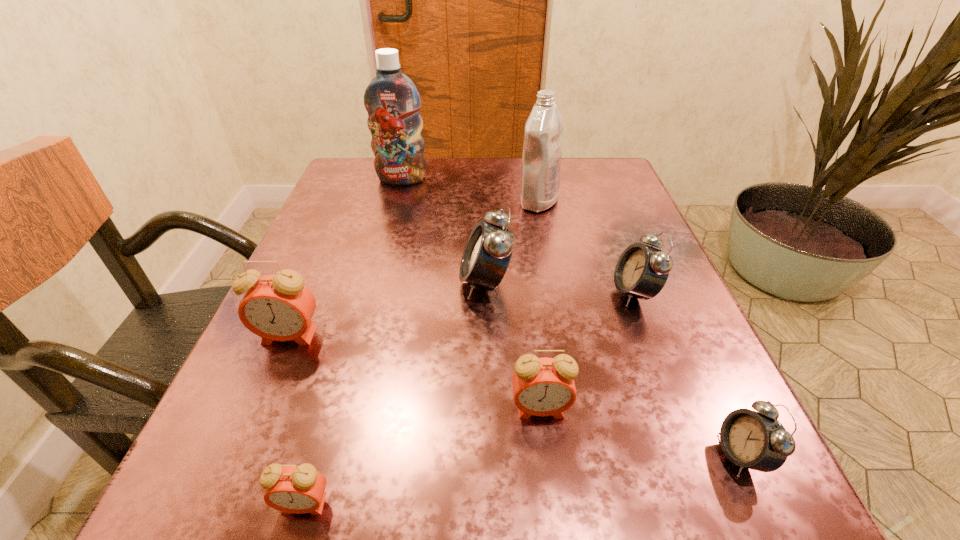
Where is `free space between the detergent and the nearest object`? The width and height of the screenshot is (960, 540). free space between the detergent and the nearest object is located at coordinates (421, 353).

At what (x,y) coordinates should I click in order to perform the action: click on free space between the second pink alarm clock from left to right and the farthest object. Please return your answer as a coordinate pair (x, y). This screenshot has height=540, width=960. Looking at the image, I should click on (353, 342).

You are a GUI agent. You are given a task and a screenshot of the screen. Output one action in this format:
    pyautogui.click(x=<x>, y=<y>)
    Task: Click on the vacant space in between the leftmost white alarm clock and the farthest pink alarm clock
    
    Given the screenshot: What is the action you would take?
    pyautogui.click(x=387, y=309)

At what (x,y) coordinates should I click in order to perform the action: click on empty space that is in between the third nearest object and the second nearest object. Please return your answer as a coordinate pair (x, y). This screenshot has width=960, height=540. Looking at the image, I should click on (641, 432).

Identify the location of vacant region between the farthest object and the detergent. (470, 190).

This screenshot has width=960, height=540. What are the coordinates of `blank region between the detergent and the blue shampoo` in the screenshot? It's located at (470, 190).

Find the location of a particular element. The height and width of the screenshot is (540, 960). free spot between the second biggest white alarm clock and the tallest object is located at coordinates (518, 235).

The image size is (960, 540). Identify the location of vacant point located between the second alarm clock from left to right and the seventh nearest object. (421, 353).

You are a GUI agent. You are given a task and a screenshot of the screen. Output one action in this format:
    pyautogui.click(x=<x>, y=<y>)
    Task: Click on the unoccupied position between the second biggest white alarm clock and the third farthest alarm clock
    This screenshot has height=540, width=960.
    Given the screenshot: What is the action you would take?
    pyautogui.click(x=462, y=314)

This screenshot has width=960, height=540. Find the location of `object that is the seventh closest one to the third nearest alarm clock`. object that is the seventh closest one to the third nearest alarm clock is located at coordinates (392, 101).